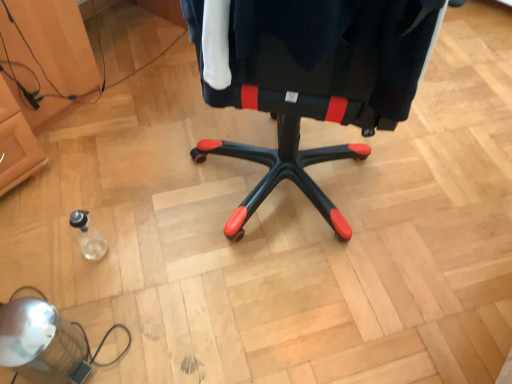
Image resolution: width=512 pixels, height=384 pixels. Describe the element at coordinates (310, 77) in the screenshot. I see `black matte office chair at center` at that location.

Where is `black matte office chair at center`? Image resolution: width=512 pixels, height=384 pixels. black matte office chair at center is located at coordinates coord(310,77).

Identify the location of black matte office chair at center. (310, 77).